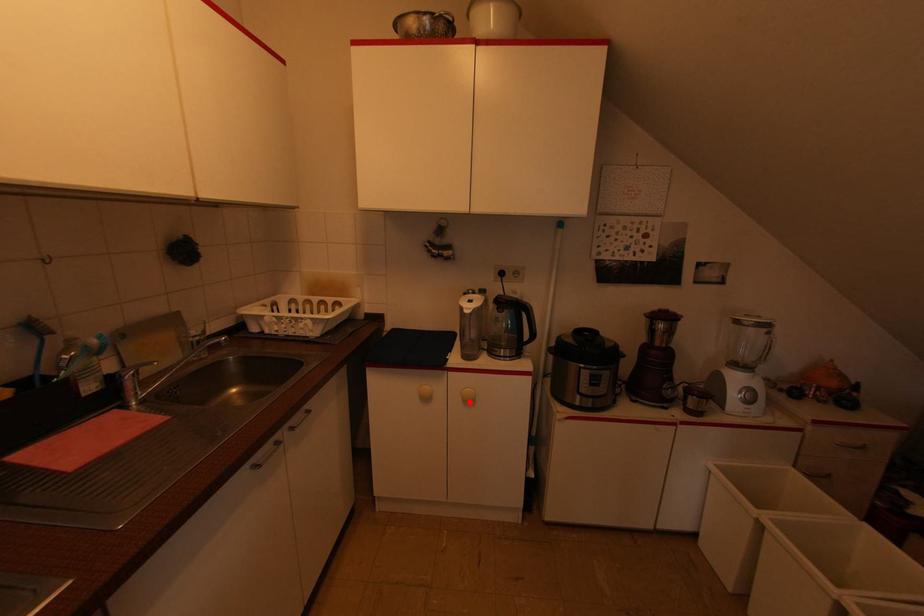
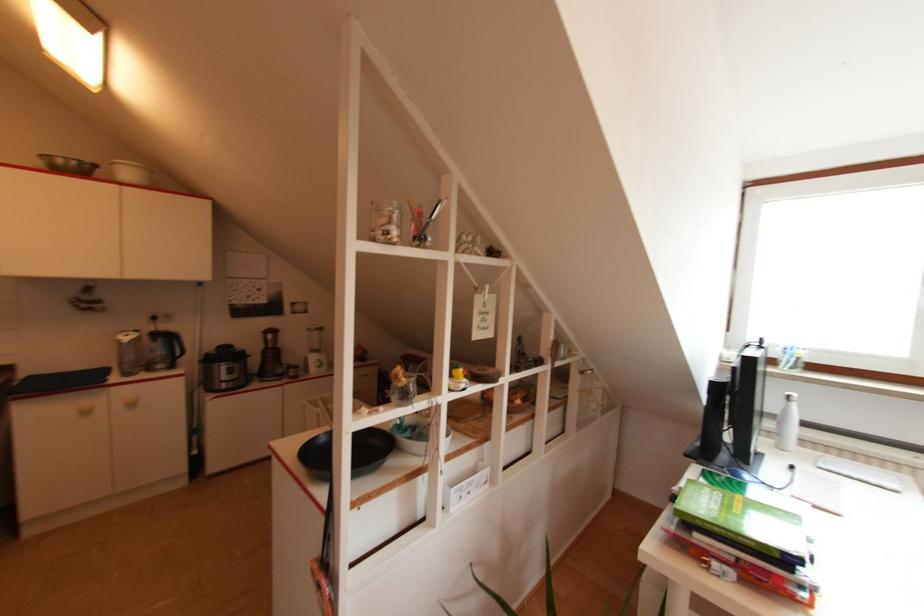
The point at the highlighted location is marked in the first image. Where is the corresponding point in the second image?

(134, 405)